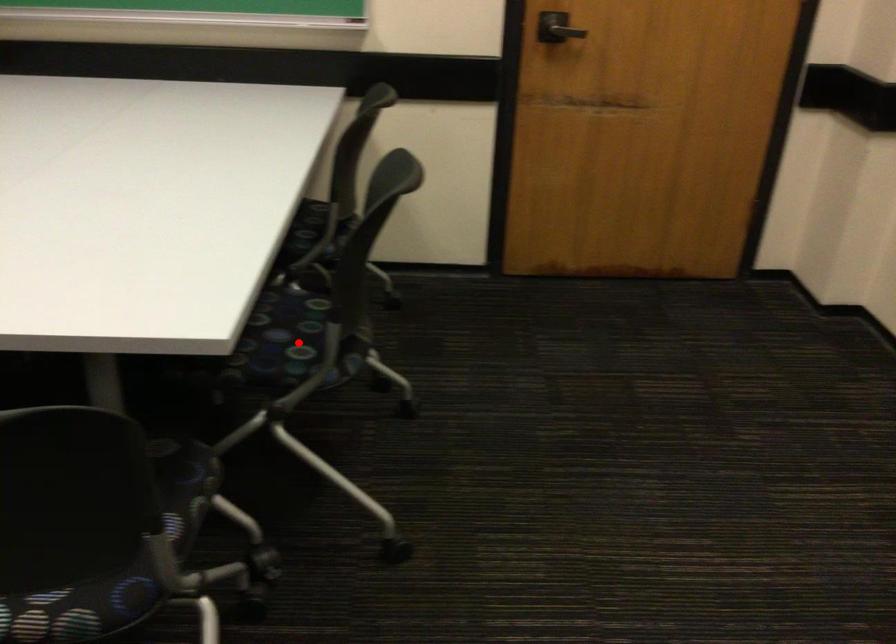
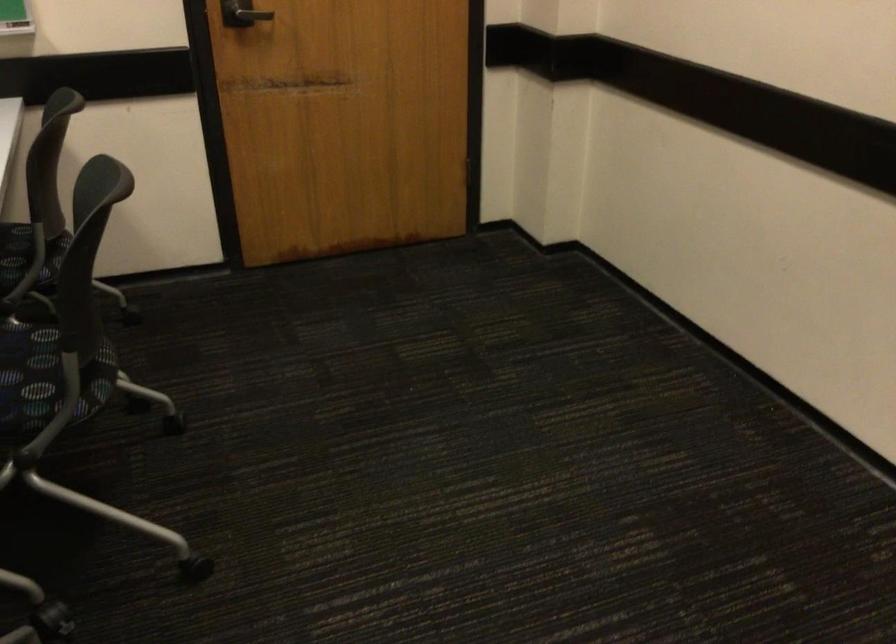
The point at the highlighted location is marked in the first image. Where is the corresponding point in the second image?

(47, 374)